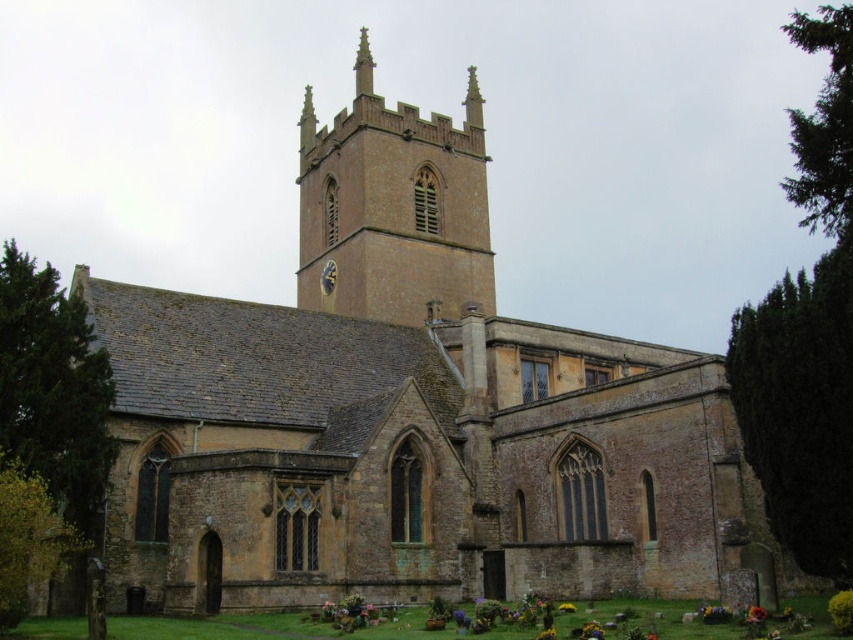
Question: Can you confirm if vibrant floral bouquet at lower right is positioned to the right of yellow matte flower at lower center?

Choices:
 (A) no
 (B) yes

Answer: (B)

Question: Which of the following is the farthest from the observer?

Choices:
 (A) smooth stone spire at upper center
 (B) purple matte flower at center
 (C) yellow matte flower at lower center

Answer: (A)

Question: Is smooth stone spire at upper center further to the viewer compared to vibrant yellow petals at lower center?

Choices:
 (A) yes
 (B) no

Answer: (A)

Question: Can you confirm if vibrant floral bouquet at lower right is positioned to the right of purple matte flower at center?

Choices:
 (A) no
 (B) yes

Answer: (B)

Question: Which of these objects is positioned farthest from the yellow matte sunflower at center?

Choices:
 (A) purple matte flower at center
 (B) brown stone tower at center

Answer: (B)

Question: Which object is positioned closest to the vibrant yellow petals at lower center?

Choices:
 (A) yellow matte flower at lower center
 (B) vibrant floral bouquet at lower right

Answer: (B)